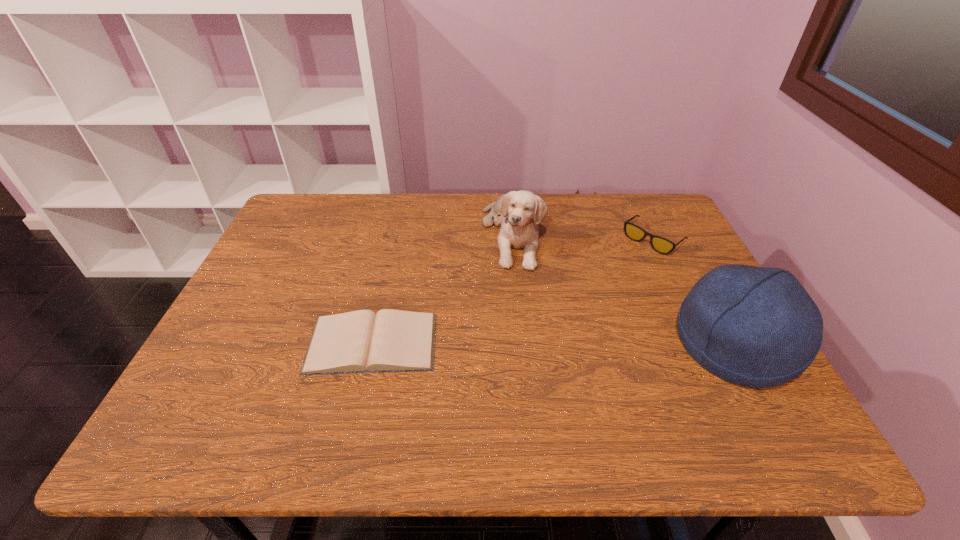
Find the location of a particular element. The image size is (960, 540). vacant spot on the desktop that is between the Bible and the tallest object and is positioned on the front-facing side of the puppy is located at coordinates (549, 343).

The height and width of the screenshot is (540, 960). Find the location of `free space on the desktop that is between the shortest object and the tallest object and is positioned on the front-facing side of the third tallest object`. free space on the desktop that is between the shortest object and the tallest object and is positioned on the front-facing side of the third tallest object is located at coordinates (533, 343).